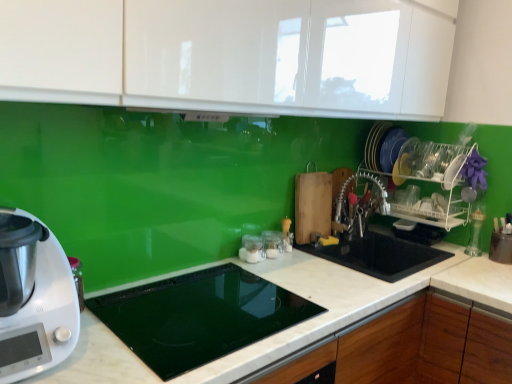
Question: Could you tell me if clear glass jar at center, marked as the 2th appliance in a back-to-front arrangement, is facing white glossy cabinet at upper center?

Choices:
 (A) yes
 (B) no

Answer: (B)

Question: Does clear glass jar at center, marked as the 2th appliance in a back-to-front arrangement, come in front of white glossy cabinet at upper center?

Choices:
 (A) yes
 (B) no

Answer: (B)

Question: From the image's perspective, is clear glass jar at center, the 2th appliance in the front-to-back sequence, on white glossy cabinet at upper center?

Choices:
 (A) yes
 (B) no

Answer: (B)

Question: Can you confirm if clear glass jar at center, the 2th appliance in the front-to-back sequence, is shorter than white glossy cabinet at upper center?

Choices:
 (A) no
 (B) yes

Answer: (B)

Question: Is clear glass jar at center, marked as the 2th appliance in a back-to-front arrangement, turned away from white glossy cabinet at upper center?

Choices:
 (A) no
 (B) yes

Answer: (A)

Question: Is white plastic food processor at lower left inside or outside of white glossy cabinet at upper center?

Choices:
 (A) inside
 (B) outside

Answer: (B)

Question: From the image's perspective, relative to white glossy cabinet at upper center, is white plastic food processor at lower left above or below?

Choices:
 (A) below
 (B) above

Answer: (A)

Question: Is white plastic food processor at lower left taller or shorter than white glossy cabinet at upper center?

Choices:
 (A) short
 (B) tall

Answer: (A)

Question: Is point (71, 321) closer or farther from the camera than point (79, 48)?

Choices:
 (A) farther
 (B) closer

Answer: (A)

Question: From a real-world perspective, is white marble countertop at center above or below clear glass jars at center, which is the third appliance from front to back?

Choices:
 (A) above
 (B) below

Answer: (B)

Question: Is white marble countertop at center in front of or behind clear glass jars at center, which is the 1th appliance from back to front, in the image?

Choices:
 (A) behind
 (B) front

Answer: (B)

Question: Considering the positions of white marble countertop at center and clear glass jars at center, which is the 1th appliance from back to front, in the image, is white marble countertop at center wider or thinner than clear glass jars at center, which is the 1th appliance from back to front,?

Choices:
 (A) wide
 (B) thin

Answer: (A)

Question: In the image, is white marble countertop at center on the left side or the right side of clear glass jars at center, which is the third appliance from front to back?

Choices:
 (A) left
 (B) right

Answer: (B)

Question: Considering the relative positions of white marble countertop at center and white plastic food processor at lower left in the image provided, is white marble countertop at center to the left or to the right of white plastic food processor at lower left?

Choices:
 (A) right
 (B) left

Answer: (A)

Question: Considering the positions of point (297, 327) and point (7, 264), is point (297, 327) closer or farther from the camera than point (7, 264)?

Choices:
 (A) closer
 (B) farther

Answer: (B)